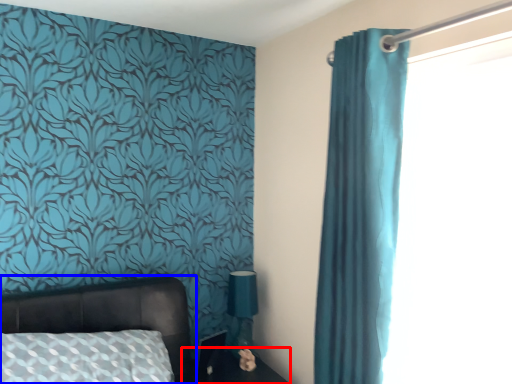
Question: Which object is closer to the camera taking this photo, side table (highlighted by a red box) or bed (highlighted by a blue box)?

Choices:
 (A) side table
 (B) bed

Answer: (B)